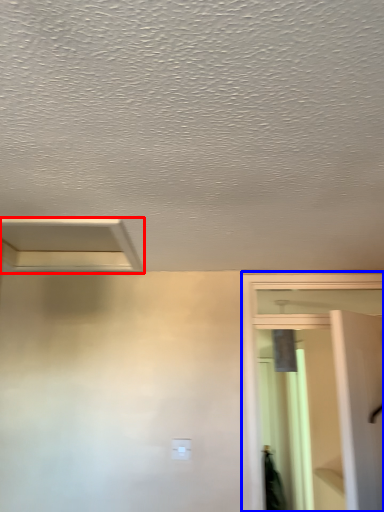
Question: Which object appears closest to the camera in this image, exhaust hood (highlighted by a red box) or screen door (highlighted by a blue box)?

Choices:
 (A) exhaust hood
 (B) screen door

Answer: (A)